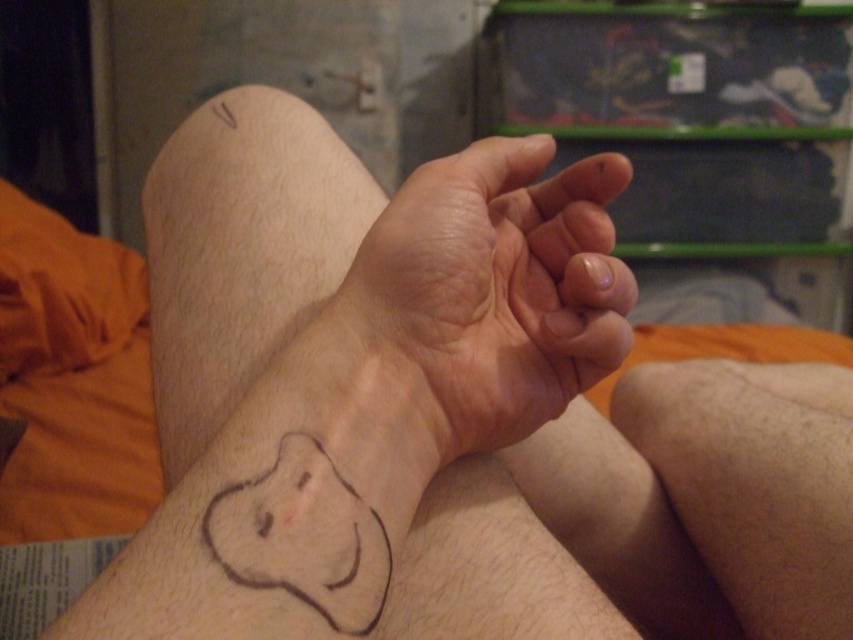
You are a photographer adjusting your camera settings. You want to capture a clear closeup of the brown ink tattoo at lower left without the camera lens getting in the shot. What is the minimum distance you need to maintain between the camera and the tattoo?

The minimum distance you need to maintain between the camera and the brown ink tattoo at lower left is 8.62 inches to ensure the camera lens does not block the tattoo in the shot.

You are a tattoo artist assessing a client who wants to place a new tattoo on their forearm. The client has a brown ink tattoo at lower left and smooth skin at center. Based on their current tattoos, where should the new tattoo be placed to avoid overlapping?

The brown ink tattoo at lower left is below smooth skin at center, so placing the new tattoo on the smooth skin at center would avoid overlapping with the existing brown ink tattoo at lower left.